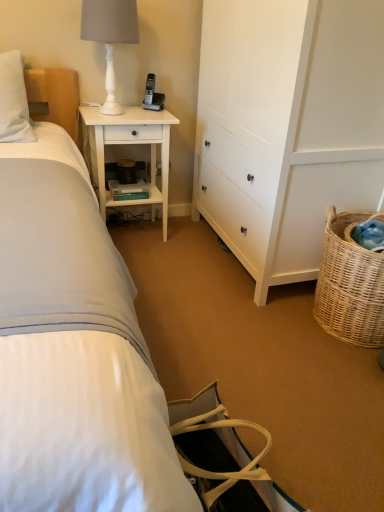
The image size is (384, 512). What do you see at coordinates (286, 125) in the screenshot? I see `white wood cabinet at center right` at bounding box center [286, 125].

The width and height of the screenshot is (384, 512). In order to click on white wood nightstand at upper left in this screenshot , I will do pos(133,144).

This screenshot has height=512, width=384. Find the location of `black plastic phone at upper center`. black plastic phone at upper center is located at coordinates (153, 95).

From the image's perspective, relative to woven natural basket at lower right, is white wood cabinet at center right above or below?

Clearly, from the image's perspective, white wood cabinet at center right is above woven natural basket at lower right.

Which of these two, white wood cabinet at center right or woven natural basket at lower right, stands shorter?

Standing shorter between the two is woven natural basket at lower right.

The image size is (384, 512). I want to click on cabinetry lying above the woven natural basket at lower right (from the image's perspective), so click(x=286, y=125).

How distant is white wood cabinet at center right from woven natural basket at lower right?

They are 15.13 inches apart.

Is white matte table lamp at upper left next to white wood nightstand at upper left?

No.

This screenshot has height=512, width=384. In order to click on table lamp that appears in front of the white wood nightstand at upper left in this screenshot , I will do `click(110, 36)`.

From a real-world perspective, is white matte table lamp at upper left physically below white wood nightstand at upper left?

Incorrect, from a real-world perspective, white matte table lamp at upper left is higher than white wood nightstand at upper left.

Consider the image. Is white matte table lamp at upper left at the right side of white wood nightstand at upper left?

No, white matte table lamp at upper left is not to the right of white wood nightstand at upper left.

Is woven natural basket at lower right facing away from white matte table lamp at upper left?

No, woven natural basket at lower right is not facing the opposite direction of white matte table lamp at upper left.

Between woven natural basket at lower right and white matte table lamp at upper left, which one is positioned in front?

woven natural basket at lower right is in front.

Can you confirm if woven natural basket at lower right is positioned to the right of white matte table lamp at upper left?

Yes.

Can you confirm if woven natural basket at lower right is taller than white matte table lamp at upper left?

Indeed, woven natural basket at lower right has a greater height compared to white matte table lamp at upper left.

Is white wood cabinet at center right looking in the opposite direction of white matte table lamp at upper left?

No, white wood cabinet at center right's orientation is not away from white matte table lamp at upper left.

Is white wood cabinet at center right situated inside white matte table lamp at upper left or outside?

The correct answer is: outside.

The image size is (384, 512). I want to click on table lamp on the left of white wood cabinet at center right, so click(x=110, y=36).

From a real-world perspective, does black plastic phone at upper center sit lower than woven natural basket at lower right?

No.

Which object is closer to the camera taking this photo, black plastic phone at upper center or woven natural basket at lower right?

woven natural basket at lower right is in front.

From the image's perspective, is black plastic phone at upper center located beneath woven natural basket at lower right?

No.

Can woven natural basket at lower right be found inside black plastic phone at upper center?

No, woven natural basket at lower right is not surrounded by black plastic phone at upper center.

From the image's perspective, who appears lower, white matte table lamp at upper left or white wood cabinet at center right?

From the image's view, white wood cabinet at center right is below.

Does white matte table lamp at upper left turn towards white wood cabinet at center right?

No, white matte table lamp at upper left is not oriented towards white wood cabinet at center right.

You are a GUI agent. You are given a task and a screenshot of the screen. Output one action in this format:
    pyautogui.click(x=<x>, y=<y>)
    Task: Click on the table lamp that appears behind the white wood cabinet at center right
    This screenshot has width=384, height=512.
    Given the screenshot: What is the action you would take?
    pyautogui.click(x=110, y=36)

Considering the points (121, 110) and (332, 125), which point is behind, point (121, 110) or point (332, 125)?

Positioned behind is point (121, 110).

Does white wood nightstand at upper left touch woven natural basket at lower right?

No, white wood nightstand at upper left is not beside woven natural basket at lower right.

Is point (136, 200) closer to viewer compared to point (353, 257)?

No, it is not.

How many degrees apart are the facing directions of white wood nightstand at upper left and woven natural basket at lower right?

There is a 89.9-degree angle between the facing directions of white wood nightstand at upper left and woven natural basket at lower right.

From the image's perspective, is white wood nightstand at upper left below woven natural basket at lower right?

No.

I want to click on picnic basket below the white wood cabinet at center right (from the image's perspective), so click(350, 285).

This screenshot has width=384, height=512. In order to click on table lamp lying on the left of white wood nightstand at upper left in this screenshot , I will do `click(110, 36)`.

In the scene shown: Estimate the real-world distances between objects in this image. Which object is closer to woven natural basket at lower right, white wood nightstand at upper left or black plastic phone at upper center?

Among the two, white wood nightstand at upper left is located nearer to woven natural basket at lower right.

Based on their spatial positions, is white wood cabinet at center right or white matte table lamp at upper left further from white wood nightstand at upper left?

white wood cabinet at center right lies further to white wood nightstand at upper left than the other object.

Considering their positions, is woven natural basket at lower right positioned closer to white wood cabinet at center right than black plastic phone at upper center?

woven natural basket at lower right lies closer to white wood cabinet at center right than the other object.

Looking at the image, which one is located further to white wood nightstand at upper left, black plastic phone at upper center or woven natural basket at lower right?

Based on the image, woven natural basket at lower right appears to be further to white wood nightstand at upper left.

Considering their positions, is white wood cabinet at center right positioned further to woven natural basket at lower right than black plastic phone at upper center?

black plastic phone at upper center is positioned further to the anchor woven natural basket at lower right.

From the image, which object appears to be farther from woven natural basket at lower right, white matte table lamp at upper left or white wood nightstand at upper left?

The object further to woven natural basket at lower right is white matte table lamp at upper left.

Considering their positions, is black plastic phone at upper center positioned further to woven natural basket at lower right than white wood cabinet at center right?

Based on the image, black plastic phone at upper center appears to be further to woven natural basket at lower right.

Which object lies nearer to the anchor point woven natural basket at lower right, white matte table lamp at upper left or black plastic phone at upper center?

black plastic phone at upper center.

The height and width of the screenshot is (512, 384). Find the location of `nightstand between white matte table lamp at upper left and white wood cabinet at center right`. nightstand between white matte table lamp at upper left and white wood cabinet at center right is located at coordinates (133, 144).

The image size is (384, 512). In order to click on cabinetry that lies between black plastic phone at upper center and woven natural basket at lower right from top to bottom in this screenshot , I will do `click(286, 125)`.

You are a GUI agent. You are given a task and a screenshot of the screen. Output one action in this format:
    pyautogui.click(x=<x>, y=<y>)
    Task: Click on the table lamp between white wood cabinet at center right and black plastic phone at upper center in the front-back direction
    The image size is (384, 512).
    Given the screenshot: What is the action you would take?
    pyautogui.click(x=110, y=36)

You are a GUI agent. You are given a task and a screenshot of the screen. Output one action in this format:
    pyautogui.click(x=<x>, y=<y>)
    Task: Click on the nightstand between white wood cabinet at center right and black plastic phone at upper center in the front-back direction
    
    Given the screenshot: What is the action you would take?
    pyautogui.click(x=133, y=144)